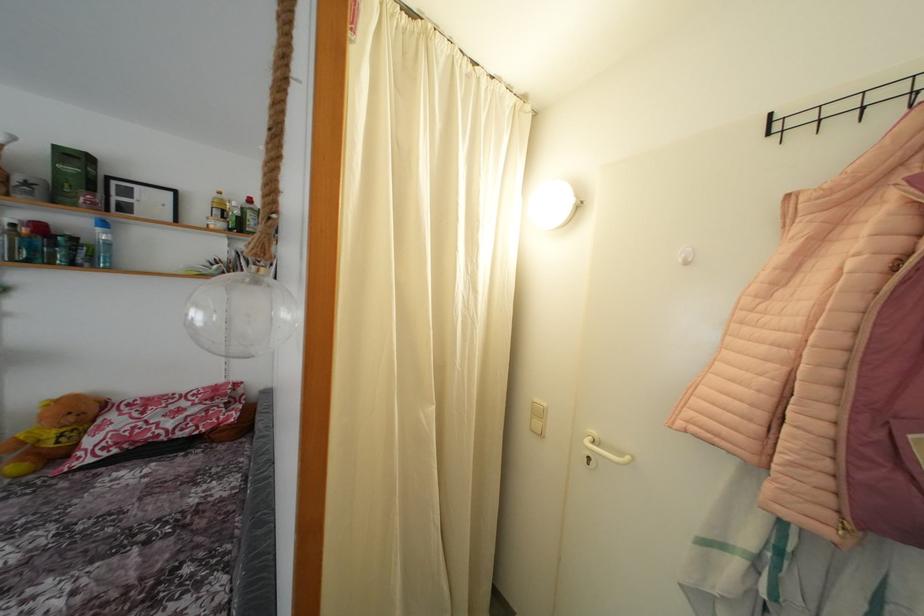
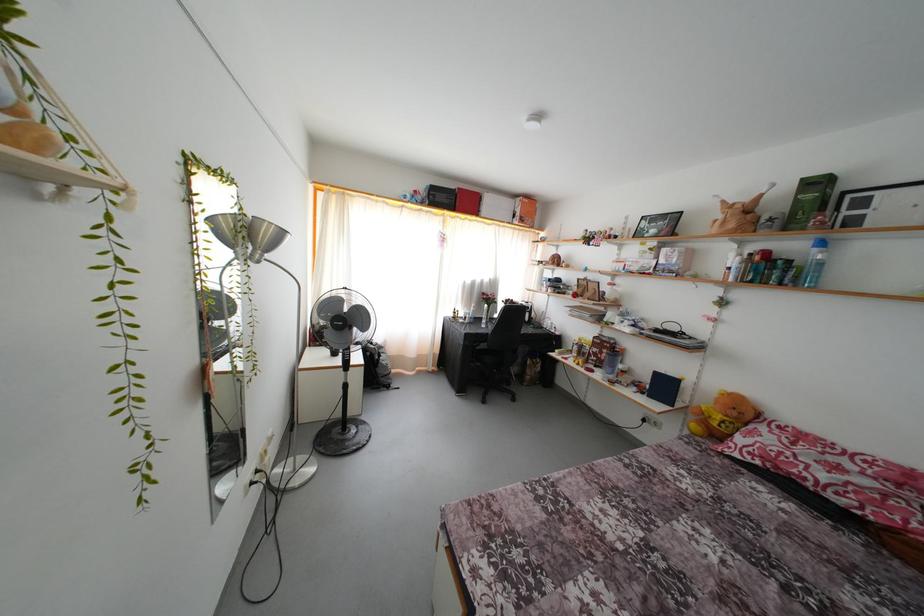
Question: The first image is from the beginning of the video and the second image is from the end. How did the camera likely rotate when shooting the video?

Choices:
 (A) Left
 (B) Right
 (C) Up
 (D) Down

Answer: (A)